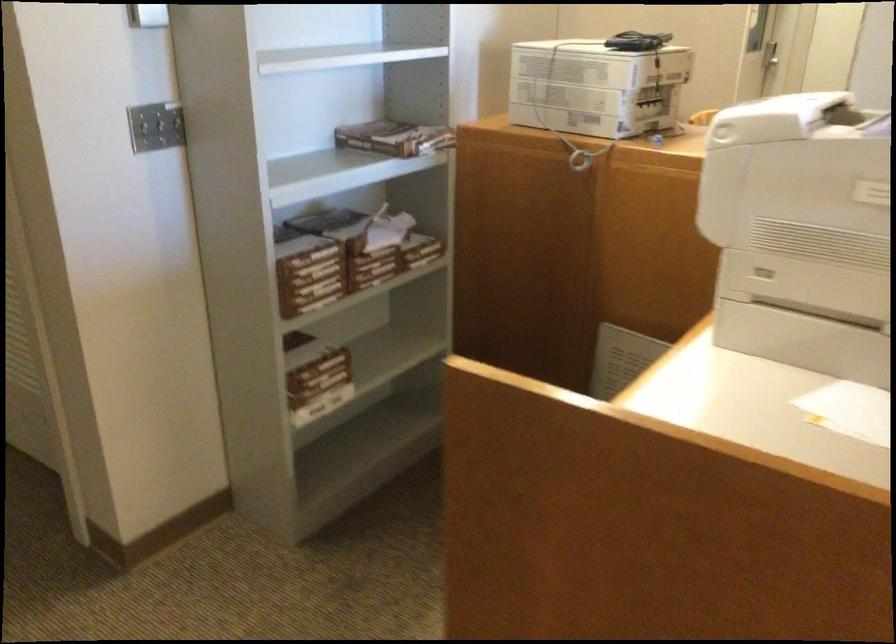
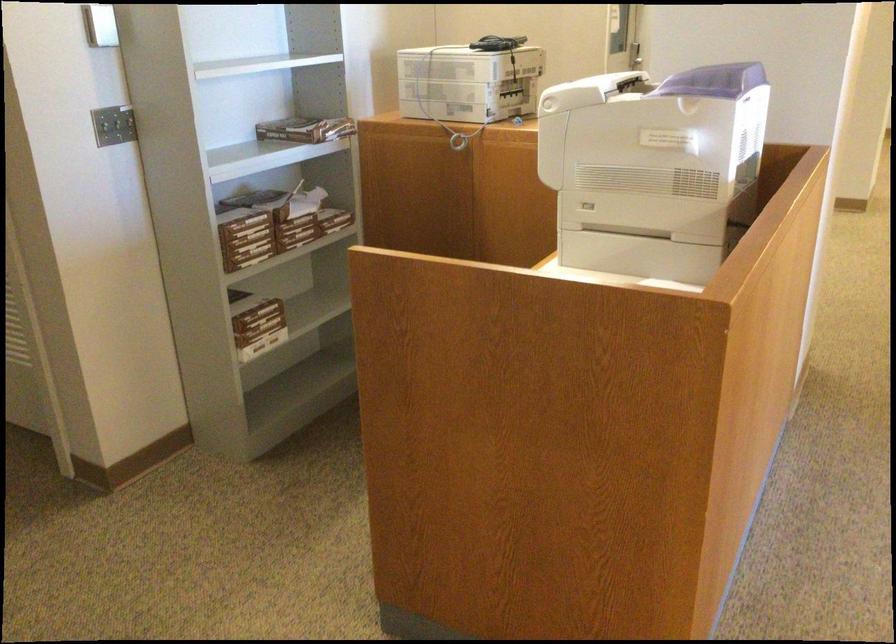
Locate, in the second image, the point that corresponds to (400,144) in the first image.

(306, 129)